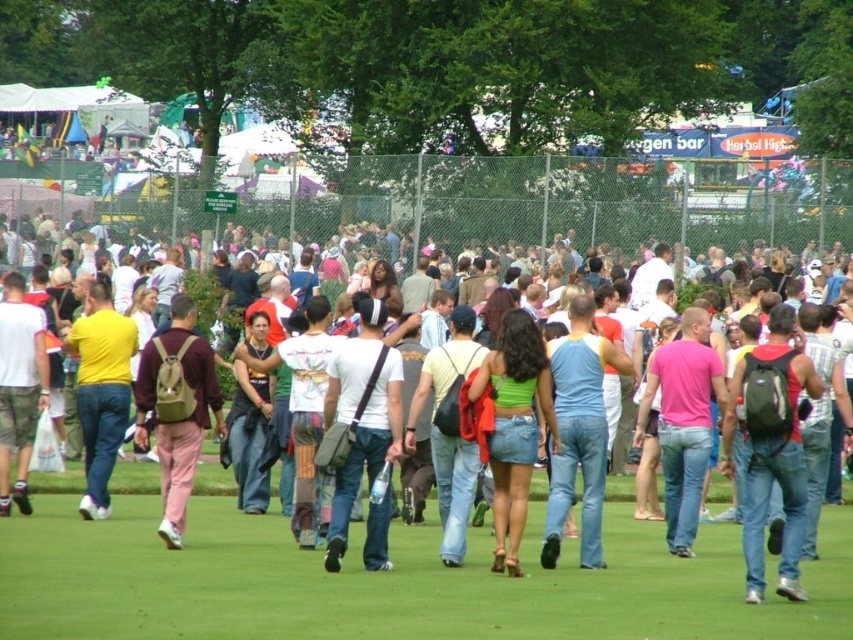
Consider the image. You are standing at the origin point in the image. There is a blue denim jeans at center located at point [579,429]. If you want to walk towards the blue denim jeans at center, in which direction should you move?

To walk towards the blue denim jeans at center located at point [579,429], you should move in the direction of the coordinates provided, which is towards the center of the image where the jeans are positioned.

You are standing at the edge of the crowd and see the blue denim jeans at center and the khaki backpack at center. Which item is positioned lower in the image?

The blue denim jeans at center is below the khaki backpack at center, so the blue denim jeans at center is positioned lower in the image.